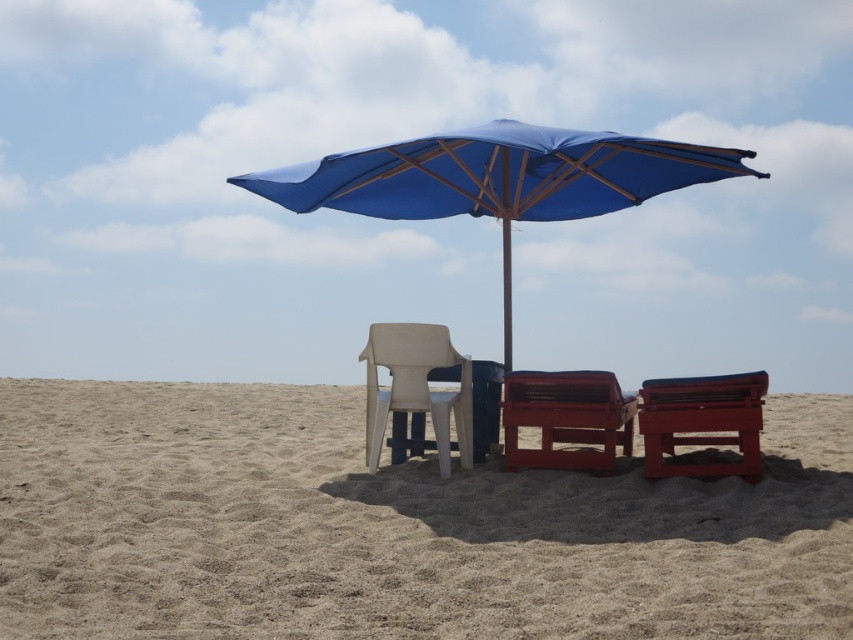
Question: Can you confirm if matte red beach chair at center is positioned above white plastic beach chair at center?

Choices:
 (A) no
 (B) yes

Answer: (A)

Question: Among these points, which one is nearest to the camera?

Choices:
 (A) (151, 577)
 (B) (517, 413)
 (C) (419, 400)
 (D) (701, 176)

Answer: (A)

Question: Observing the image, what is the correct spatial positioning of blue fabric umbrella at center in reference to white plastic beach chair at center?

Choices:
 (A) right
 (B) left

Answer: (A)

Question: Which point is closer to the camera?

Choices:
 (A) (329, 563)
 (B) (399, 152)
 (C) (431, 336)
 (D) (680, 426)

Answer: (A)

Question: Does matte red plastic beach chair at lower right come behind white plastic beach chair at center?

Choices:
 (A) no
 (B) yes

Answer: (A)

Question: Which of the following is the farthest from the observer?

Choices:
 (A) (440, 397)
 (B) (718, 426)
 (C) (601, 460)

Answer: (A)